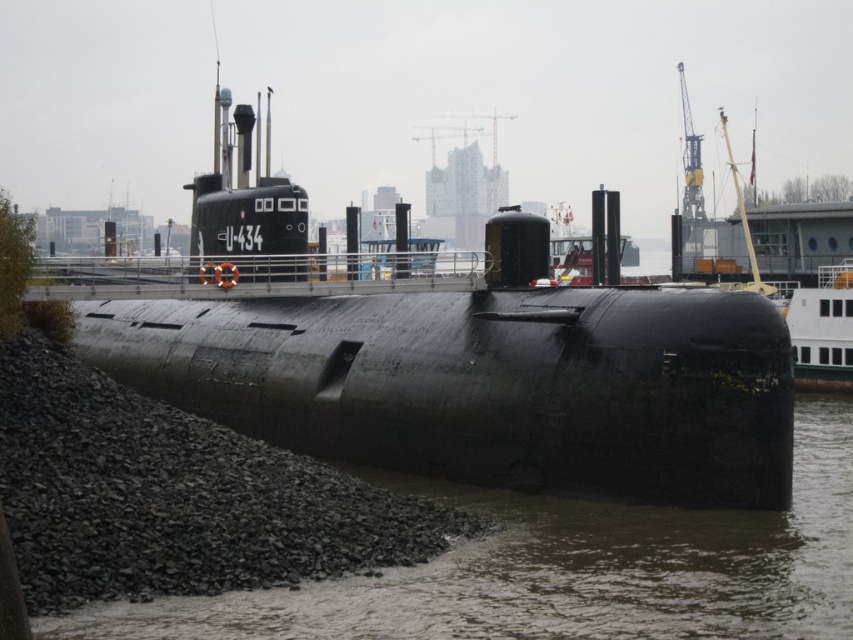
Question: Which object is farther from the camera taking this photo?

Choices:
 (A) brown murky water at lower center
 (B) matte black submarine at center
 (C) black gravel at lower left

Answer: (B)

Question: Does matte black submarine at center appear under black gravel at lower left?

Choices:
 (A) yes
 (B) no

Answer: (B)

Question: Which of the following is the farthest from the observer?

Choices:
 (A) matte black submarine at center
 (B) black gravel at lower left
 (C) brown murky water at lower center

Answer: (A)

Question: Does matte black submarine at center have a lesser width compared to black gravel at lower left?

Choices:
 (A) yes
 (B) no

Answer: (B)

Question: Which object is the farthest from the matte black submarine at center?

Choices:
 (A) brown murky water at lower center
 (B) black gravel at lower left

Answer: (A)

Question: Can you confirm if matte black submarine at center is thinner than brown murky water at lower center?

Choices:
 (A) yes
 (B) no

Answer: (B)